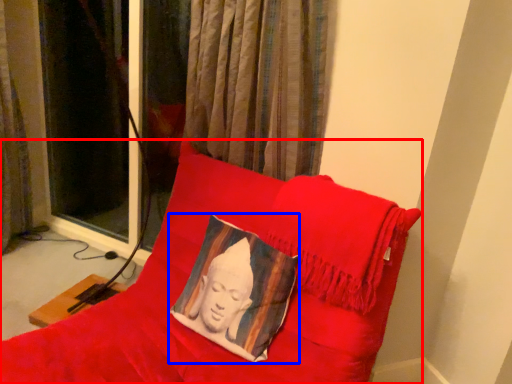
Question: Which object is further to the camera taking this photo, furniture (highlighted by a red box) or pillow (highlighted by a blue box)?

Choices:
 (A) furniture
 (B) pillow

Answer: (B)